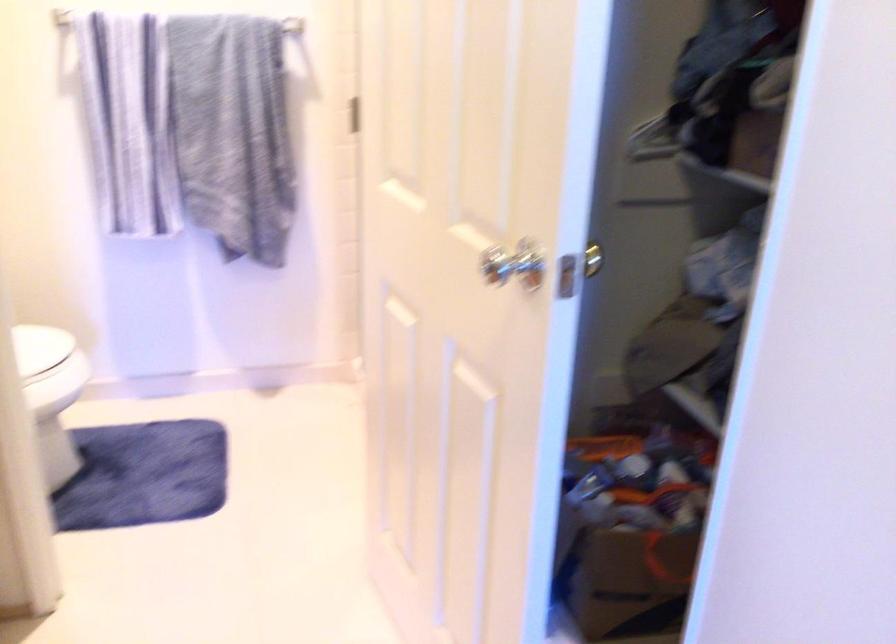
Where would you lift the white toilet lid? Please return your answer as a coordinate pair (x, y).

(45, 368)